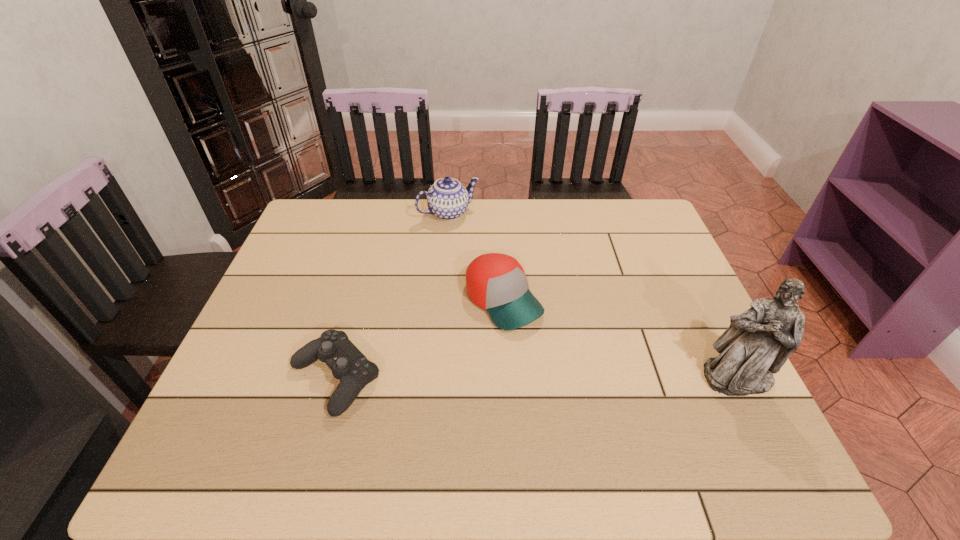
What are the coordinates of `object at the near left corner` in the screenshot? It's located at (348, 364).

The width and height of the screenshot is (960, 540). Find the location of `object located at the near right corner`. object located at the near right corner is located at coordinates coord(758,342).

Locate an element on the screen. The height and width of the screenshot is (540, 960). vacant space at the far edge of the desktop is located at coordinates (496, 244).

Locate an element on the screen. The height and width of the screenshot is (540, 960). vacant space at the near edge of the desktop is located at coordinates (603, 389).

In the image, there is a desktop. Find the location of `vacant space at the left edge`. vacant space at the left edge is located at coordinates (287, 261).

This screenshot has height=540, width=960. I want to click on free space at the right edge of the desktop, so click(653, 277).

Locate an element on the screen. The image size is (960, 540). vacant space at the far right corner of the desktop is located at coordinates (x=654, y=245).

The width and height of the screenshot is (960, 540). What are the coordinates of `vacant space in between the figurine and the leftmost object` in the screenshot? It's located at (536, 377).

The width and height of the screenshot is (960, 540). Identify the location of vacant space that's between the baseball cap and the leftmost object. click(420, 339).

Find the location of a particular element. The height and width of the screenshot is (540, 960). vacant area between the chinaware and the second shortest object is located at coordinates (476, 257).